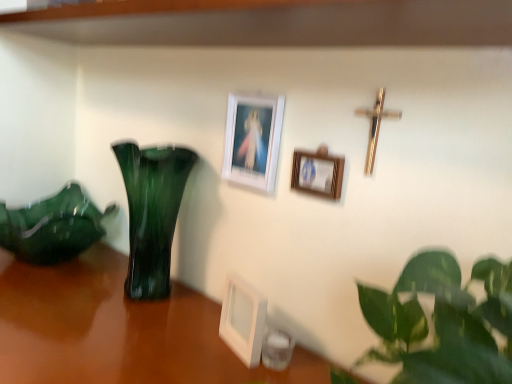
Question: From the image's perspective, is white matte picture frame at upper center, which appears as the 3th picture frame when ordered from the bottom, above or below green glass vase at left?

Choices:
 (A) above
 (B) below

Answer: (A)

Question: Considering the positions of white matte picture frame at upper center, arranged as the first picture frame when viewed from the top, and green glass vase at left in the image, is white matte picture frame at upper center, arranged as the first picture frame when viewed from the top, bigger or smaller than green glass vase at left?

Choices:
 (A) small
 (B) big

Answer: (A)

Question: Which is nearer to the wooden picture frame at center, which is the second picture frame from bottom to top?

Choices:
 (A) green glass vase at left
 (B) white plastic picture frame at center, the 1th picture frame ordered from the bottom
 (C) gold metallic crucifix at upper right
 (D) green glass vase at left
 (E) white matte picture frame at upper center, which appears as the 3th picture frame when ordered from the bottom

Answer: (C)

Question: Considering the real-world distances, which object is farthest from the gold metallic crucifix at upper right?

Choices:
 (A) white plastic picture frame at center, placed as the third picture frame when sorted from top to bottom
 (B) green glass vase at left
 (C) green glass vase at left
 (D) white matte picture frame at upper center, arranged as the first picture frame when viewed from the top
 (E) wooden picture frame at center, which is the second picture frame from bottom to top

Answer: (C)